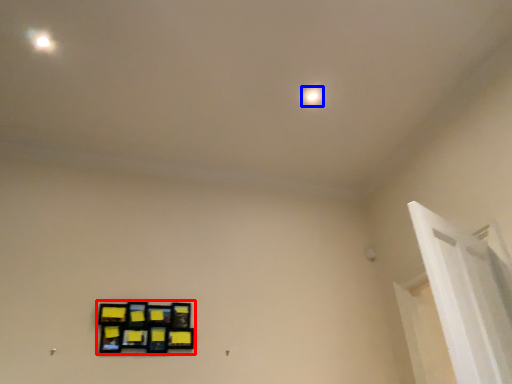
Question: Which object appears closest to the camera in this image, picture frame (highlighted by a red box) or dot (highlighted by a blue box)?

Choices:
 (A) picture frame
 (B) dot

Answer: (A)